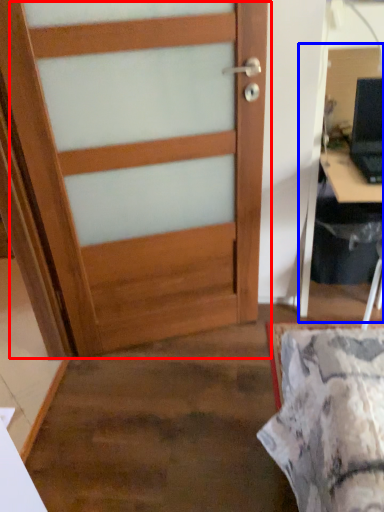
Question: Which of the following is the farthest to the observer, door (highlighted by a red box) or computer desk (highlighted by a blue box)?

Choices:
 (A) door
 (B) computer desk

Answer: (A)